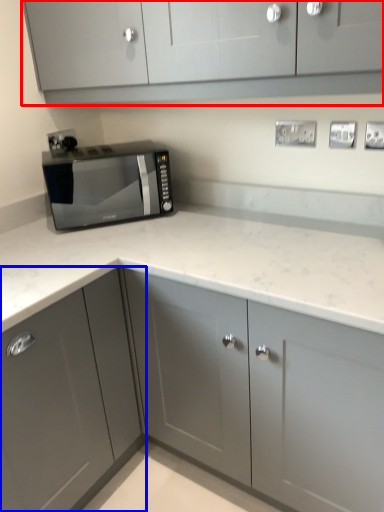
Question: Which object appears closest to the camera in this image, cabinetry (highlighted by a red box) or cabinetry (highlighted by a blue box)?

Choices:
 (A) cabinetry
 (B) cabinetry

Answer: (A)